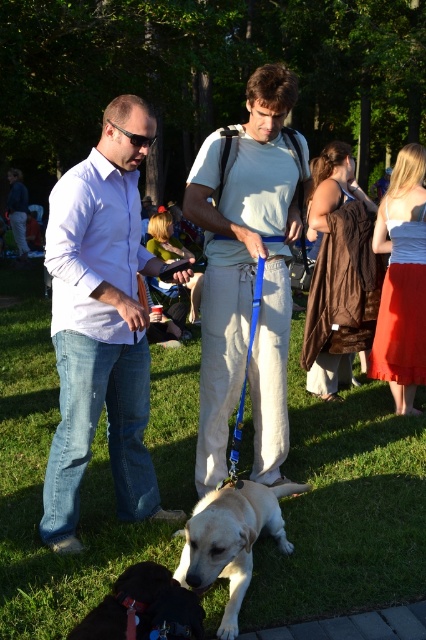
Question: Where is light beige cotton shirt at center located in relation to brown fur dog at lower center in the image?

Choices:
 (A) left
 (B) right

Answer: (B)

Question: Which of the following is the closest to the observer?

Choices:
 (A) [204, 248]
 (B) [166, 243]

Answer: (A)

Question: Is matte white shirt at center thinner than brown suede dress at center?

Choices:
 (A) no
 (B) yes

Answer: (A)

Question: Which of the following is the farthest from the observer?

Choices:
 (A) (x=170, y=230)
 (B) (x=249, y=269)
 (C) (x=319, y=184)

Answer: (A)

Question: Is green grass at center above brown fur dog at lower center?

Choices:
 (A) no
 (B) yes

Answer: (B)

Question: Among these objects, which one is nearest to the camera?

Choices:
 (A) green fabric jacket at center
 (B) light beige fur at lower center

Answer: (B)